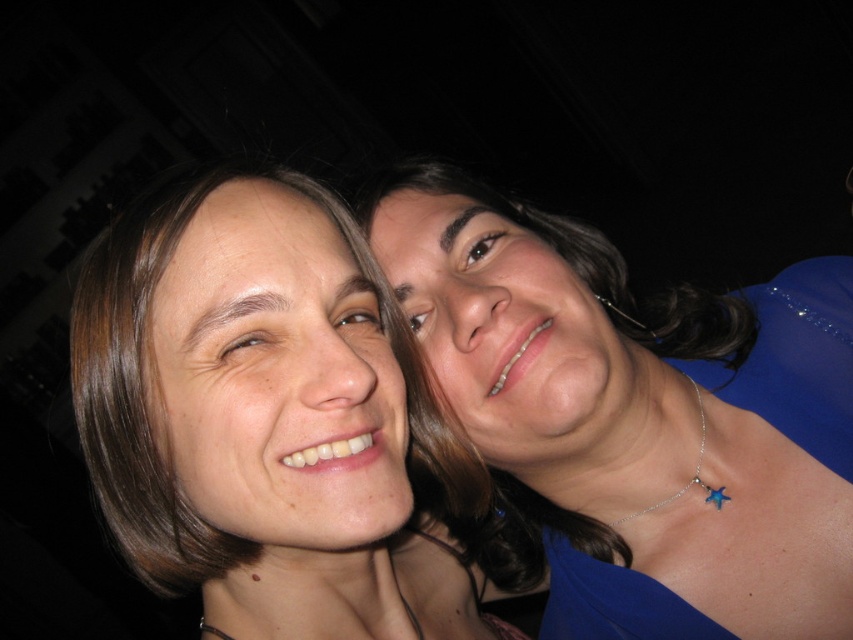
Between blue satin dress at right and smooth skin face at center, which one appears on the left side from the viewer's perspective?

From the viewer's perspective, smooth skin face at center appears more on the left side.

Does point (697, 504) lie behind point (170, 257)?

Yes, it is.

Locate an element on the screen. This screenshot has height=640, width=853. blue satin dress at right is located at coordinates (639, 416).